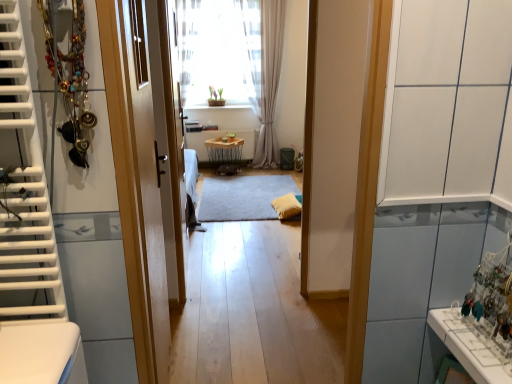
I want to click on vacant space underneath transparent plastic screen door at center (from a real-world perspective), so click(189, 264).